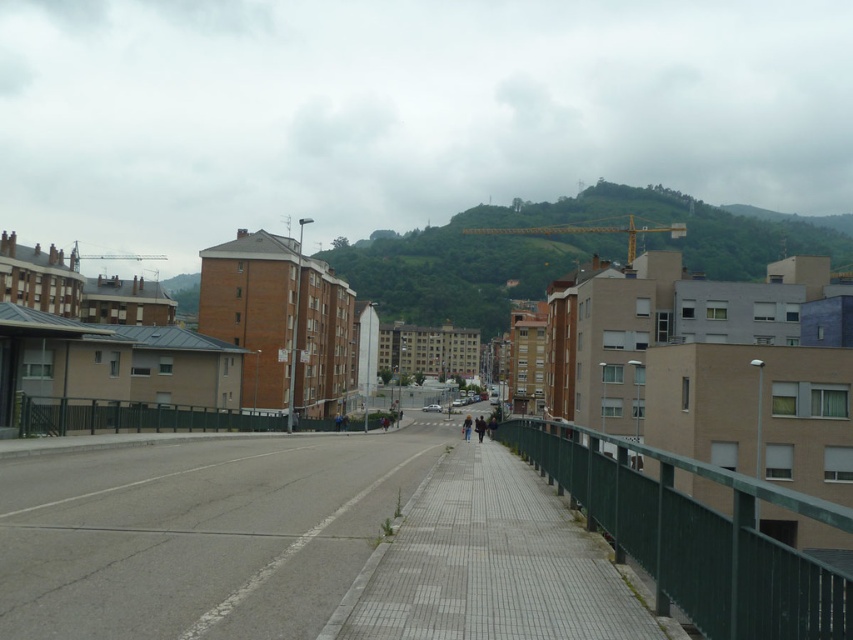
Who is positioned more to the right, gray concrete pavement at center or dark blue jacket at center?

From the viewer's perspective, dark blue jacket at center appears more on the right side.

Who is taller, gray concrete pavement at center or dark blue jacket at center?

Standing taller between the two is dark blue jacket at center.

Measure the distance between gray concrete pavement at center and camera.

gray concrete pavement at center is 5.64 meters from camera.

Locate an element on the screen. The image size is (853, 640). gray concrete pavement at center is located at coordinates (490, 563).

Is gray concrete sidewalk at center taller than dark blue jacket at center?

No.

Between gray concrete sidewalk at center and dark blue jacket at center, which one has less height?

gray concrete sidewalk at center

Who is more distant from viewer, (x=300, y=609) or (x=471, y=422)?

Point (x=471, y=422)

Where is `gray concrete sidewalk at center`? This screenshot has width=853, height=640. gray concrete sidewalk at center is located at coordinates (200, 532).

Which is behind, point (141, 593) or point (442, 628)?

Positioned behind is point (141, 593).

Does gray concrete sidewalk at center have a larger size compared to gray concrete pavement at center?

Indeed, gray concrete sidewalk at center has a larger size compared to gray concrete pavement at center.

You are a GUI agent. You are given a task and a screenshot of the screen. Output one action in this format:
    pyautogui.click(x=<x>, y=<y>)
    Task: Click on the gray concrete sidewalk at center
    This screenshot has height=640, width=853.
    Given the screenshot: What is the action you would take?
    pyautogui.click(x=200, y=532)